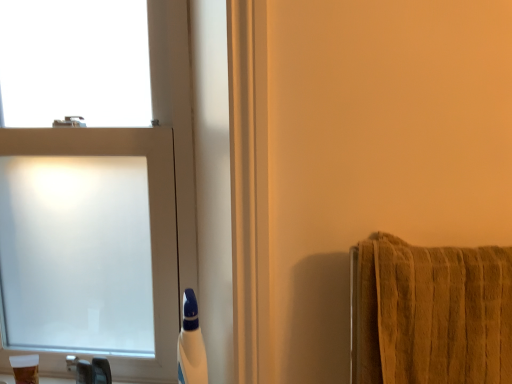
Find the location of a particular element. The height and width of the screenshot is (384, 512). brushed metal faucet at lower left is located at coordinates (90, 370).

The height and width of the screenshot is (384, 512). What do you see at coordinates (25, 368) in the screenshot?
I see `translucent plastic cup at lower left, positioned as the first toiletry in left-to-right order` at bounding box center [25, 368].

Measure the distance between point (184, 383) and camera.

Point (184, 383) is 35.91 inches from camera.

Identify the location of brushed metal faucet at lower left. (90, 370).

From the picture: Is brushed metal faucet at lower left outside of translucent plastic cup at lower left, positioned as the first toiletry in left-to-right order?

Yes, brushed metal faucet at lower left is outside of translucent plastic cup at lower left, positioned as the first toiletry in left-to-right order.

Is brushed metal faucet at lower left at the left side of translucent plastic cup at lower left, arranged as the second toiletry when viewed from the right?

In fact, brushed metal faucet at lower left is to the right of translucent plastic cup at lower left, arranged as the second toiletry when viewed from the right.

Locate an element on the screen. faucet behind the translucent plastic cup at lower left, positioned as the first toiletry in left-to-right order is located at coordinates (90, 370).

In terms of width, does brushed metal faucet at lower left look wider or thinner when compared to translucent plastic cup at lower left, arranged as the second toiletry when viewed from the right?

brushed metal faucet at lower left is thinner than translucent plastic cup at lower left, arranged as the second toiletry when viewed from the right.

Between brushed metal faucet at lower left and white plastic bottle at lower center, which is the second toiletry from left to right, which one is positioned behind?

Positioned behind is brushed metal faucet at lower left.

Can you see brushed metal faucet at lower left touching white plastic bottle at lower center, which is the second toiletry from left to right?

They are not placed beside each other.

From a real-world perspective, which object stands above the other?

From a 3D spatial view, white plastic bottle at lower center, which is the second toiletry from left to right, is above.

Is white plastic bottle at lower center, which is the second toiletry from left to right, surrounded by brushed metal faucet at lower left?

Definitely not — white plastic bottle at lower center, which is the second toiletry from left to right, is not inside brushed metal faucet at lower left.

Looking at this image, between brushed metal faucet at lower left and frosted glass window at left, which one is positioned behind?

brushed metal faucet at lower left is more distant.

Is brushed metal faucet at lower left inside or outside of frosted glass window at left?

The correct answer is: outside.

From a real-world perspective, which is physically above, brushed metal faucet at lower left or frosted glass window at left?

frosted glass window at left is physically above.

Is brushed metal faucet at lower left facing towards frosted glass window at left?

No.

In the image, is white plastic bottle at lower center, which is the second toiletry from left to right, on the left side or the right side of frosted glass window at left?

Based on their positions, white plastic bottle at lower center, which is the second toiletry from left to right, is located to the right of frosted glass window at left.

Would you say white plastic bottle at lower center, the first toiletry in the right-to-left sequence, is outside frosted glass window at left?

Yes, white plastic bottle at lower center, the first toiletry in the right-to-left sequence, is not within frosted glass window at left.

From their relative heights in the image, would you say white plastic bottle at lower center, which is the second toiletry from left to right, is taller or shorter than frosted glass window at left?

white plastic bottle at lower center, which is the second toiletry from left to right, is shorter than frosted glass window at left.

Which of these two, translucent plastic cup at lower left, positioned as the first toiletry in left-to-right order, or frosted glass window at left, stands taller?

With more height is frosted glass window at left.

How much distance is there between translucent plastic cup at lower left, arranged as the second toiletry when viewed from the right, and frosted glass window at left?

18.01 inches.

Is translucent plastic cup at lower left, positioned as the first toiletry in left-to-right order, with frosted glass window at left?

No, translucent plastic cup at lower left, positioned as the first toiletry in left-to-right order, is not making contact with frosted glass window at left.

From the picture: From a real-world perspective, which is physically above, translucent plastic cup at lower left, positioned as the first toiletry in left-to-right order, or frosted glass window at left?

frosted glass window at left.

Is frosted glass window at left directly adjacent to translucent plastic cup at lower left, positioned as the first toiletry in left-to-right order?

No, frosted glass window at left is not touching translucent plastic cup at lower left, positioned as the first toiletry in left-to-right order.

From the image's perspective, would you say frosted glass window at left is shown under translucent plastic cup at lower left, arranged as the second toiletry when viewed from the right?

No, from the image's perspective, frosted glass window at left is not beneath translucent plastic cup at lower left, arranged as the second toiletry when viewed from the right.

From a real-world perspective, who is located lower, frosted glass window at left or translucent plastic cup at lower left, positioned as the first toiletry in left-to-right order?

translucent plastic cup at lower left, positioned as the first toiletry in left-to-right order.

Is frosted glass window at left facing towards translucent plastic cup at lower left, positioned as the first toiletry in left-to-right order?

Yes, frosted glass window at left is oriented towards translucent plastic cup at lower left, positioned as the first toiletry in left-to-right order.

The image size is (512, 384). I want to click on faucet below the frosted glass window at left (from the image's perspective), so click(90, 370).

Is frosted glass window at left touching brushed metal faucet at lower left?

No, frosted glass window at left is not next to brushed metal faucet at lower left.

From a real-world perspective, is frosted glass window at left positioned above or below brushed metal faucet at lower left?

Clearly, from a real-world perspective, frosted glass window at left is above brushed metal faucet at lower left.

In terms of width, does frosted glass window at left look wider or thinner when compared to brushed metal faucet at lower left?

In the image, frosted glass window at left appears to be wider than brushed metal faucet at lower left.

The image size is (512, 384). I want to click on toiletry to the left of brushed metal faucet at lower left, so click(x=25, y=368).

What are the coordinates of `the 2nd toiletry above the brushed metal faucet at lower left (from a real-world perspective)` in the screenshot? It's located at (191, 344).

From the image, which object appears to be nearer to brushed metal faucet at lower left, frosted glass window at left or translucent plastic cup at lower left, arranged as the second toiletry when viewed from the right?

Among the two, translucent plastic cup at lower left, arranged as the second toiletry when viewed from the right, is located nearer to brushed metal faucet at lower left.

Based on their spatial positions, is brushed metal faucet at lower left or frosted glass window at left closer to white plastic bottle at lower center, which is the second toiletry from left to right?

brushed metal faucet at lower left lies closer to white plastic bottle at lower center, which is the second toiletry from left to right, than the other object.

When comparing their distances from translucent plastic cup at lower left, arranged as the second toiletry when viewed from the right, does white plastic bottle at lower center, which is the second toiletry from left to right, or brushed metal faucet at lower left seem closer?

The object closer to translucent plastic cup at lower left, arranged as the second toiletry when viewed from the right, is brushed metal faucet at lower left.

Considering their positions, is brushed metal faucet at lower left positioned further to translucent plastic cup at lower left, arranged as the second toiletry when viewed from the right, than frosted glass window at left?

The object further to translucent plastic cup at lower left, arranged as the second toiletry when viewed from the right, is frosted glass window at left.

In the scene shown: Which object lies nearer to the anchor point white plastic bottle at lower center, the first toiletry in the right-to-left sequence, brushed metal faucet at lower left or translucent plastic cup at lower left, positioned as the first toiletry in left-to-right order?

brushed metal faucet at lower left.

Considering their positions, is white plastic bottle at lower center, the first toiletry in the right-to-left sequence, positioned closer to frosted glass window at left than translucent plastic cup at lower left, positioned as the first toiletry in left-to-right order?

white plastic bottle at lower center, the first toiletry in the right-to-left sequence, is closer to frosted glass window at left.

From the image, which object appears to be nearer to white plastic bottle at lower center, which is the second toiletry from left to right, translucent plastic cup at lower left, positioned as the first toiletry in left-to-right order, or brushed metal faucet at lower left?

brushed metal faucet at lower left is positioned closer to the anchor white plastic bottle at lower center, which is the second toiletry from left to right.

Looking at the image, which one is located further to white plastic bottle at lower center, which is the second toiletry from left to right, translucent plastic cup at lower left, arranged as the second toiletry when viewed from the right, or frosted glass window at left?

The object further to white plastic bottle at lower center, which is the second toiletry from left to right, is translucent plastic cup at lower left, arranged as the second toiletry when viewed from the right.

Find the location of a particular element. The image size is (512, 384). faucet between translucent plastic cup at lower left, arranged as the second toiletry when viewed from the right, and white plastic bottle at lower center, which is the second toiletry from left to right, in the horizontal direction is located at coordinates (90, 370).

I want to click on toiletry between frosted glass window at left and brushed metal faucet at lower left from top to bottom, so click(191, 344).

Identify the location of faucet that lies between frosted glass window at left and translucent plastic cup at lower left, positioned as the first toiletry in left-to-right order, from top to bottom. (90, 370).

Identify the location of toiletry between frosted glass window at left and translucent plastic cup at lower left, arranged as the second toiletry when viewed from the right, in the up-down direction. The width and height of the screenshot is (512, 384). (191, 344).